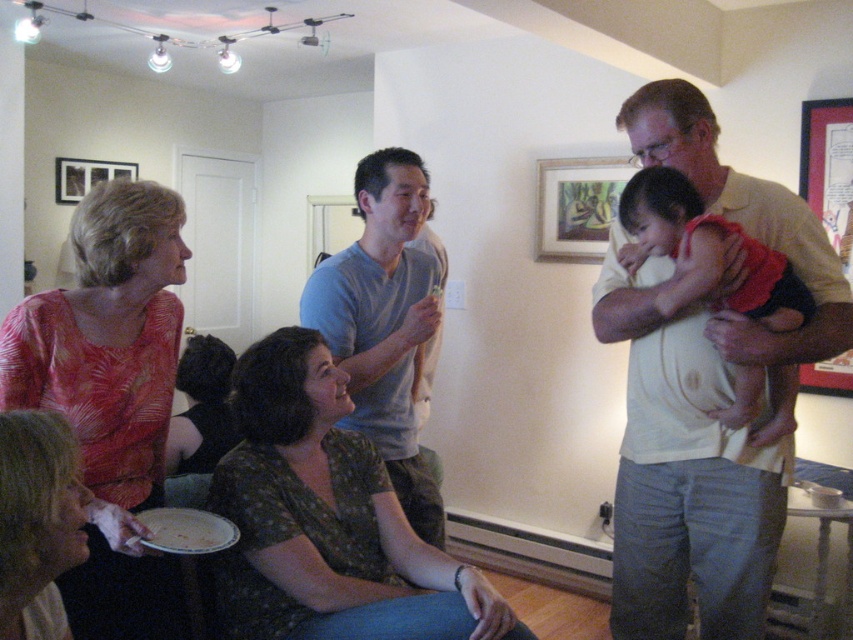
Question: Does printed silk blouse at left have a lesser width compared to matte pink blouse at lower left?

Choices:
 (A) no
 (B) yes

Answer: (A)

Question: Which object appears closest to the camera in this image?

Choices:
 (A) printed silk blouse at left
 (B) matte pink blouse at lower left
 (C) light beige shirt at upper right
 (D) light blue cotton shirt at center

Answer: (B)

Question: Does light beige shirt at upper right come behind green floral shirt at center?

Choices:
 (A) yes
 (B) no

Answer: (A)

Question: Among these points, which one is nearest to the camera?

Choices:
 (A) (16, 612)
 (B) (643, 186)

Answer: (A)

Question: Can you confirm if light beige shirt at upper right is positioned above matte red shirt at upper right?

Choices:
 (A) no
 (B) yes

Answer: (A)

Question: Which object is farther from the camera taking this photo?

Choices:
 (A) matte red shirt at upper right
 (B) light beige shirt at upper right

Answer: (B)